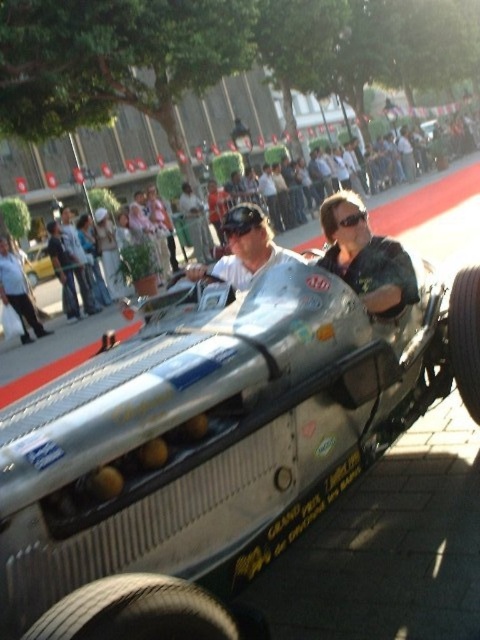
Question: Which is farther from the white shirt at left?

Choices:
 (A) silver metallic racecar at center
 (B) black rubber tire at lower left
 (C) black rubber tire at lower right
 (D) metallic silver helmet at center

Answer: (B)

Question: Which of the following is the closest to the observer?

Choices:
 (A) (477, 292)
 (B) (22, 317)
 (C) (33, 285)

Answer: (A)

Question: Does black rubber tire at lower left appear under white shirt at left?

Choices:
 (A) no
 (B) yes

Answer: (B)

Question: Is matte silver helmet at center bigger than black rubber tire at lower right?

Choices:
 (A) no
 (B) yes

Answer: (B)

Question: Which of these objects is positioned closest to the matte silver helmet at center?

Choices:
 (A) black rubber tire at lower left
 (B) metallic silver helmet at center
 (C) white shirt at left
 (D) black rubber tire at lower right

Answer: (D)

Question: Can you confirm if black rubber tire at lower right is smaller than silver metallic racecar at center?

Choices:
 (A) yes
 (B) no

Answer: (A)